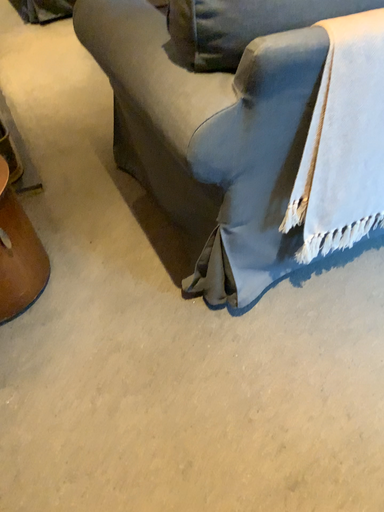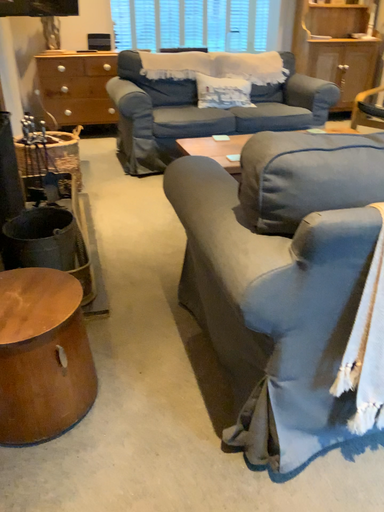
Question: How did the camera likely rotate when shooting the video?

Choices:
 (A) rotated upward
 (B) rotated downward

Answer: (A)